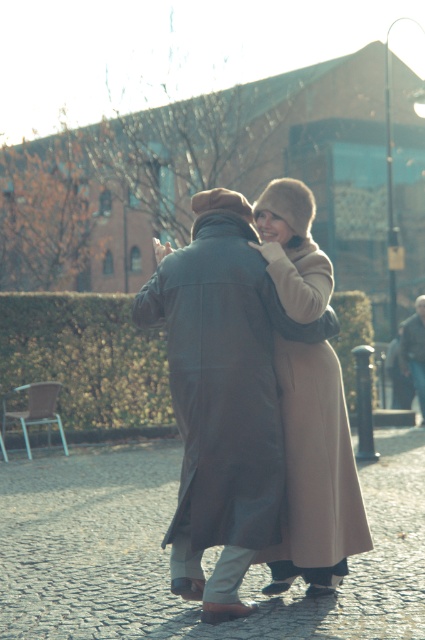
You are standing in the urban park and want to place a small bench exactly at the coordinates mentioned for the leather coat at center. Is this possible without overlapping the coat?

The leather coat at center is located at point (254, 397), so placing a bench there would overlap with the coat, making it impossible.

You are a tailor measuring the distance between two coats for a custom fitting. The coats are the leather coat at center and the beige wool coat at center. Can you fit a 6.5 inch wide tailor tool between them?

The distance between the leather coat at center and the beige wool coat at center is 6.74 inches. Since the tailor tool is 6.5 inches wide, it can fit between them as there is enough space.

You are standing at the center of the park and see the point marked at coordinates (316, 472). What object is located at that point?

The point at coordinates (316, 472) corresponds to the beige wool coat at center.